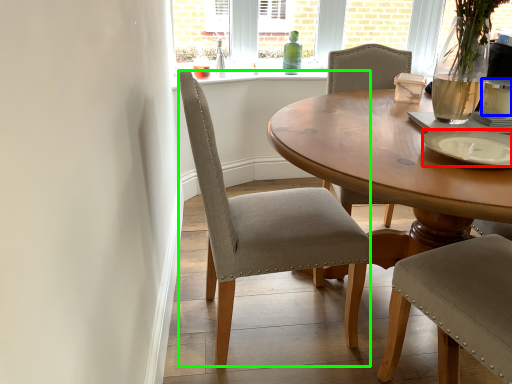
Question: Considering the real-world distances, which object is farthest from plate (highlighted by a red box)? coffee cup (highlighted by a blue box) or chair (highlighted by a green box)?

Choices:
 (A) coffee cup
 (B) chair

Answer: (B)